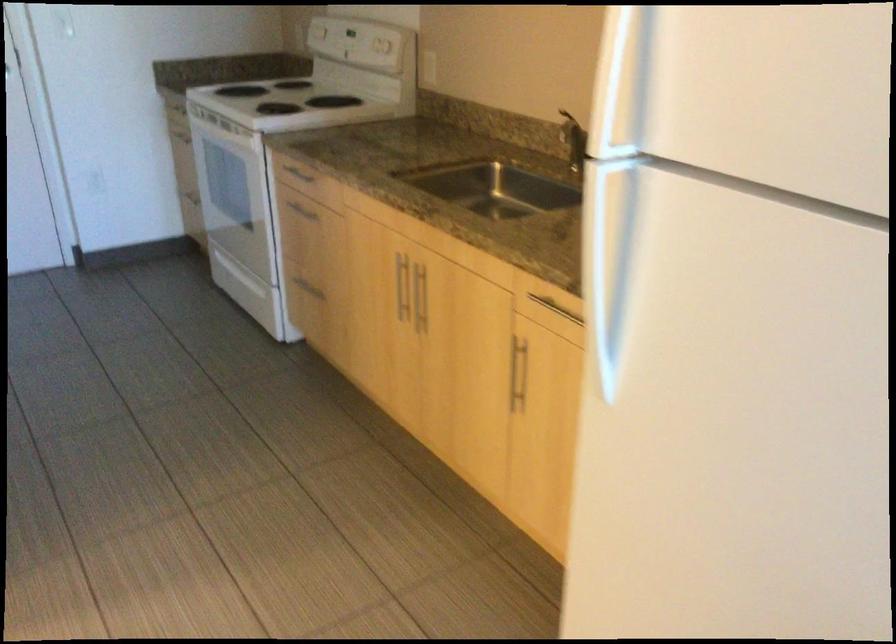
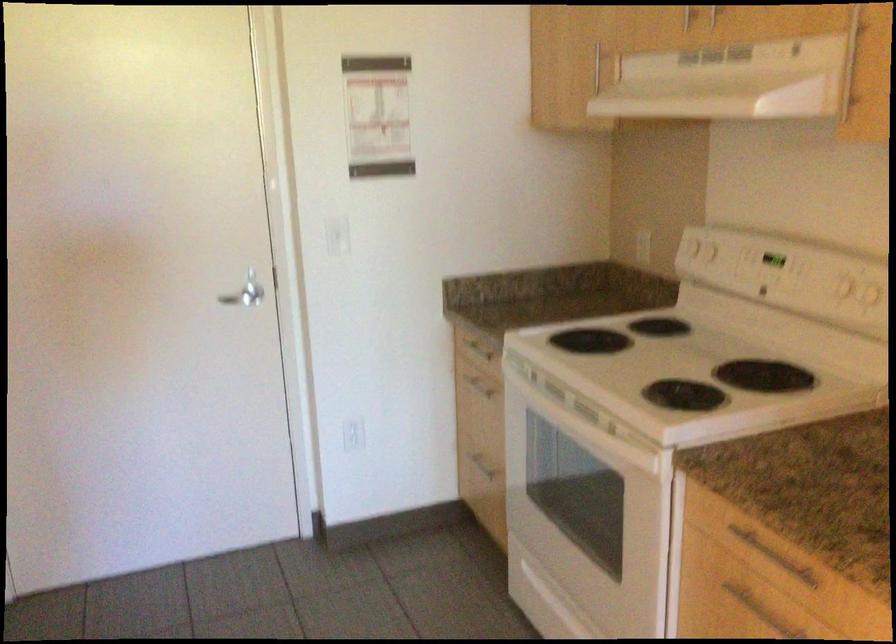
Question: I am providing you with two images of the same scene from different viewpoints. Please identify which objects are invisible in image2.

Choices:
 (A) white light switch
 (B) cabinet handle
 (C) white stove dial
 (D) none of these

Answer: (D)